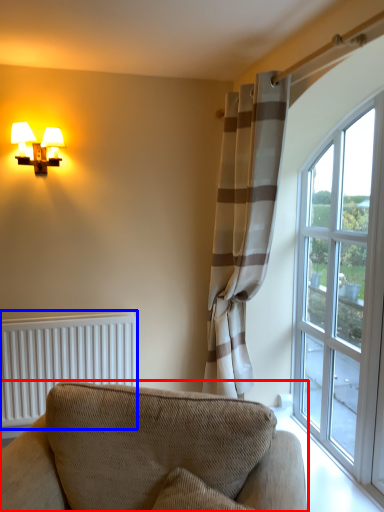
Question: Which object appears farthest to the camera in this image, studio couch (highlighted by a red box) or radiator (highlighted by a blue box)?

Choices:
 (A) studio couch
 (B) radiator

Answer: (B)